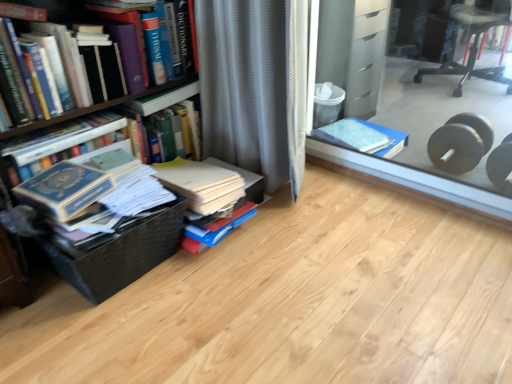
Question: Is wooden bookcase at left wider than black woven basket at lower left?

Choices:
 (A) no
 (B) yes

Answer: (B)

Question: Is wooden bookcase at left to the left of black woven basket at lower left from the viewer's perspective?

Choices:
 (A) yes
 (B) no

Answer: (A)

Question: Does wooden bookcase at left contain black woven basket at lower left?

Choices:
 (A) yes
 (B) no

Answer: (B)

Question: Is wooden bookcase at left oriented away from black woven basket at lower left?

Choices:
 (A) yes
 (B) no

Answer: (B)

Question: Is wooden bookcase at left thinner than black woven basket at lower left?

Choices:
 (A) no
 (B) yes

Answer: (A)

Question: Is wooden bookcase at left outside black woven basket at lower left?

Choices:
 (A) yes
 (B) no

Answer: (A)

Question: From the image's perspective, is blue cardboard box at center above black plastic chair at upper right?

Choices:
 (A) yes
 (B) no

Answer: (B)

Question: From the image's perspective, is blue cardboard box at center beneath black plastic chair at upper right?

Choices:
 (A) no
 (B) yes

Answer: (B)

Question: From a real-world perspective, is blue cardboard box at center on black plastic chair at upper right?

Choices:
 (A) no
 (B) yes

Answer: (A)

Question: Does blue cardboard box at center have a lesser height compared to black plastic chair at upper right?

Choices:
 (A) no
 (B) yes

Answer: (B)

Question: Is blue cardboard box at center at the left side of black plastic chair at upper right?

Choices:
 (A) no
 (B) yes

Answer: (B)

Question: Is blue cardboard box at center taller than black plastic chair at upper right?

Choices:
 (A) yes
 (B) no

Answer: (B)

Question: Does gray textured curtain at center have a greater height compared to hardcover book at left, arranged as the 1th book when viewed from the left?

Choices:
 (A) yes
 (B) no

Answer: (A)